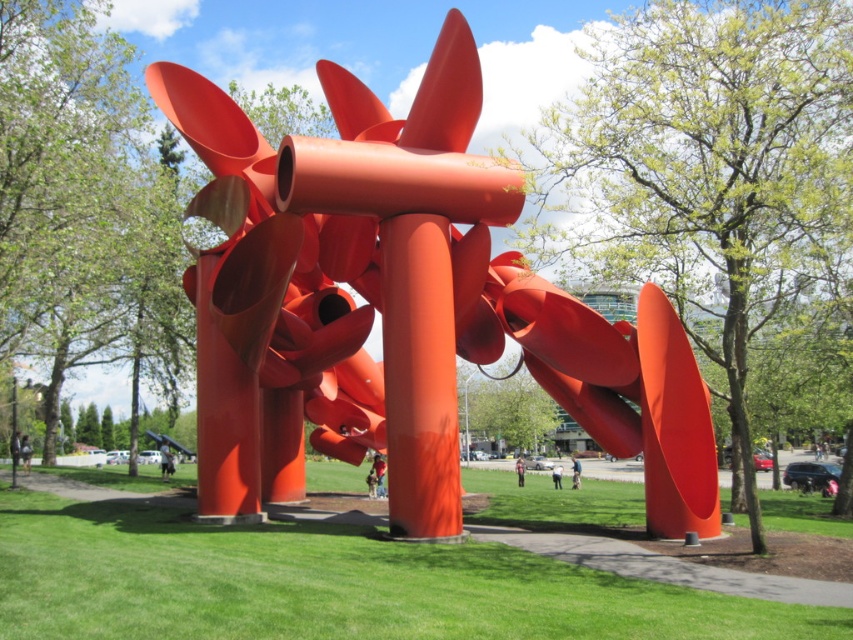
Question: Which of these objects is positioned closest to the matte black person at lower left?

Choices:
 (A) blue denim jeans at center
 (B) matte red pants at center
 (C) green grass at center
 (D) skinny jeans at center

Answer: (B)

Question: Does dark gray suit at center have a greater width compared to skinny jeans at center?

Choices:
 (A) yes
 (B) no

Answer: (A)

Question: Can you confirm if glossy metal sculpture at center is positioned to the right of matte red pants at center?

Choices:
 (A) no
 (B) yes

Answer: (B)

Question: Is blurred cotton shirt at center to the right of blue denim jeans at center from the viewer's perspective?

Choices:
 (A) no
 (B) yes

Answer: (A)

Question: Which of these objects is positioned farthest from the glossy metal sculpture at center?

Choices:
 (A) blue denim jeans at center
 (B) dark gray suit at center

Answer: (A)

Question: Estimate the real-world distances between objects in this image. Which object is farther from the matte red pants at center?

Choices:
 (A) glossy metal sculpture at center
 (B) blurred cotton shirt at center
 (C) green grass at center

Answer: (C)